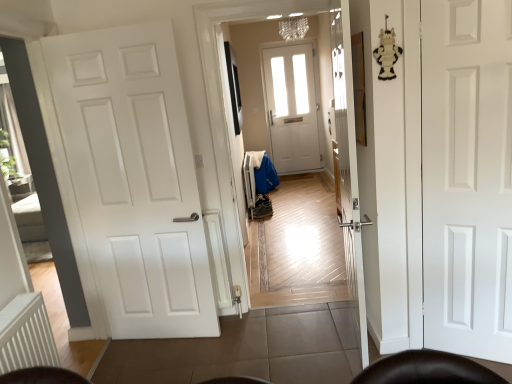
Describe the element at coordinates (467, 176) in the screenshot. Image resolution: width=512 pixels, height=384 pixels. I see `white matte door at right, acting as the 1th door starting from the right` at that location.

The width and height of the screenshot is (512, 384). Find the location of `white matte door at left, acting as the 1th door starting from the left`. white matte door at left, acting as the 1th door starting from the left is located at coordinates (134, 178).

Is there a large distance between white ribbed radiator at lower left and white matte door at left, which is the 2th door from right to left?

That's right, there is a large distance between white ribbed radiator at lower left and white matte door at left, which is the 2th door from right to left.

Considering the relative sizes of white ribbed radiator at lower left and white matte door at left, acting as the 1th door starting from the left, in the image provided, is white ribbed radiator at lower left smaller than white matte door at left, acting as the 1th door starting from the left,?

Correct, white ribbed radiator at lower left occupies less space than white matte door at left, acting as the 1th door starting from the left.

Between white ribbed radiator at lower left and white matte door at left, which is the 2th door from right to left, which one has smaller width?

white matte door at left, which is the 2th door from right to left, is thinner.

In order to click on radiator below the white matte door at left, which is the 2th door from right to left (from the image's perspective) in this screenshot , I will do `click(26, 334)`.

Considering the relative sizes of white matte door at left, which is the 2th door from right to left, and white ribbed radiator at lower left in the image provided, is white matte door at left, which is the 2th door from right to left, wider than white ribbed radiator at lower left?

Incorrect, the width of white matte door at left, which is the 2th door from right to left, does not surpass that of white ribbed radiator at lower left.

Are white matte door at left, which is the 2th door from right to left, and white ribbed radiator at lower left far apart?

Absolutely, white matte door at left, which is the 2th door from right to left, is distant from white ribbed radiator at lower left.

Is white matte door at left, acting as the 1th door starting from the left, at the left side of white ribbed radiator at lower left?

In fact, white matte door at left, acting as the 1th door starting from the left, is to the right of white ribbed radiator at lower left.

Is white matte door at left, acting as the 1th door starting from the left, completely or partially outside of white ribbed radiator at lower left?

Yes, white matte door at left, acting as the 1th door starting from the left, is located beyond the bounds of white ribbed radiator at lower left.

Does white matte door at left, which is the 2th door from right to left, turn towards white matte door at right, which is the 2th door in left-to-right order?

No, white matte door at left, which is the 2th door from right to left, is not aimed at white matte door at right, which is the 2th door in left-to-right order.

Is white matte door at left, which is the 2th door from right to left, positioned far away from white matte door at right, acting as the 1th door starting from the right?

white matte door at left, which is the 2th door from right to left, is far away from white matte door at right, acting as the 1th door starting from the right.

Can you tell me how much white matte door at left, acting as the 1th door starting from the left, and white matte door at right, which is the 2th door in left-to-right order, differ in facing direction?

The facing directions of white matte door at left, acting as the 1th door starting from the left, and white matte door at right, which is the 2th door in left-to-right order, are 20.9 degrees apart.

Consider the image. Could you tell me if white matte door at right, which is the 2th door in left-to-right order, is facing white ribbed radiator at lower left?

No, white matte door at right, which is the 2th door in left-to-right order, is not facing towards white ribbed radiator at lower left.

Is white matte door at right, acting as the 1th door starting from the right, further to the viewer compared to white ribbed radiator at lower left?

That is True.

Can you confirm if white matte door at right, which is the 2th door in left-to-right order, is taller than white ribbed radiator at lower left?

Yes, white matte door at right, which is the 2th door in left-to-right order, is taller than white ribbed radiator at lower left.

From the image's perspective, which one is positioned higher, white matte door at right, acting as the 1th door starting from the right, or white matte door at left, acting as the 1th door starting from the left?

white matte door at right, acting as the 1th door starting from the right.

Is white matte door at right, which is the 2th door in left-to-right order, outside of white matte door at left, which is the 2th door from right to left?

That's correct, white matte door at right, which is the 2th door in left-to-right order, is outside of white matte door at left, which is the 2th door from right to left.

Considering the positions of objects white matte door at right, acting as the 1th door starting from the right, and white matte door at left, which is the 2th door from right to left, in the image provided, who is in front, white matte door at right, acting as the 1th door starting from the right, or white matte door at left, which is the 2th door from right to left,?

white matte door at right, acting as the 1th door starting from the right.

Considering the sizes of objects white ribbed radiator at lower left and white matte door at right, acting as the 1th door starting from the right, in the image provided, who is shorter, white ribbed radiator at lower left or white matte door at right, acting as the 1th door starting from the right,?

Standing shorter between the two is white ribbed radiator at lower left.

Is white ribbed radiator at lower left with white matte door at right, which is the 2th door in left-to-right order?

white ribbed radiator at lower left and white matte door at right, which is the 2th door in left-to-right order, are clearly separated.

Is white ribbed radiator at lower left to the left of white matte door at right, acting as the 1th door starting from the right, from the viewer's perspective?

Correct, you'll find white ribbed radiator at lower left to the left of white matte door at right, acting as the 1th door starting from the right.

The image size is (512, 384). I want to click on radiator in front of the white matte door at left, acting as the 1th door starting from the left, so click(26, 334).

Locate an element on the screen. radiator on the left of the white matte door at left, acting as the 1th door starting from the left is located at coordinates (26, 334).

When comparing their distances from white ribbed radiator at lower left, does white matte door at right, which is the 2th door in left-to-right order, or white matte door at left, which is the 2th door from right to left, seem closer?

white matte door at left, which is the 2th door from right to left, is positioned closer to the anchor white ribbed radiator at lower left.

Considering their positions, is white matte door at left, which is the 2th door from right to left, positioned closer to white matte door at right, acting as the 1th door starting from the right, than white ribbed radiator at lower left?

Based on the image, white matte door at left, which is the 2th door from right to left, appears to be nearer to white matte door at right, acting as the 1th door starting from the right.

Looking at this image, estimate the real-world distances between objects in this image. Which object is further from white matte door at left, acting as the 1th door starting from the left, white ribbed radiator at lower left or white matte door at right, which is the 2th door in left-to-right order?

white matte door at right, which is the 2th door in left-to-right order.

Estimate the real-world distances between objects in this image. Which object is further from white ribbed radiator at lower left, white matte door at left, which is the 2th door from right to left, or white matte door at right, acting as the 1th door starting from the right?

Based on the image, white matte door at right, acting as the 1th door starting from the right, appears to be further to white ribbed radiator at lower left.

Estimate the real-world distances between objects in this image. Which object is closer to white matte door at right, acting as the 1th door starting from the right, white ribbed radiator at lower left or white matte door at left, which is the 2th door from right to left?

white matte door at left, which is the 2th door from right to left, is positioned closer to the anchor white matte door at right, acting as the 1th door starting from the right.

Looking at the image, which one is located further to white matte door at left, which is the 2th door from right to left, white matte door at right, acting as the 1th door starting from the right, or white ribbed radiator at lower left?

white matte door at right, acting as the 1th door starting from the right.

You are a GUI agent. You are given a task and a screenshot of the screen. Output one action in this format:
    pyautogui.click(x=<x>, y=<y>)
    Task: Click on the door between white ribbed radiator at lower left and white matte door at right, acting as the 1th door starting from the right
    
    Given the screenshot: What is the action you would take?
    click(x=134, y=178)